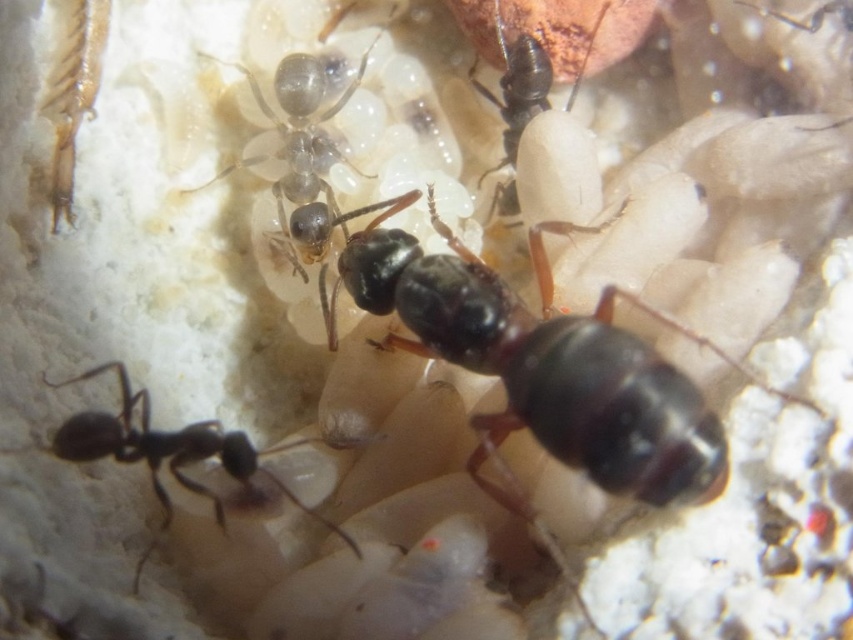
Question: Can you confirm if shiny black ant at center is thinner than black glossy ant at lower left?

Choices:
 (A) yes
 (B) no

Answer: (B)

Question: Which of the following is the closest to the observer?

Choices:
 (A) (743, 1)
 (B) (294, 124)
 (C) (125, 452)
 (D) (579, 416)

Answer: (D)

Question: Observing the image, what is the correct spatial positioning of translucent gelatinous ant at center in reference to shiny black ant at upper center?

Choices:
 (A) right
 (B) left

Answer: (B)

Question: Among these objects, which one is nearest to the camera?

Choices:
 (A) black glossy ant at lower left
 (B) shiny black ant at center

Answer: (B)

Question: Where is shiny black ant at center located in relation to black glossy ant at lower left in the image?

Choices:
 (A) below
 (B) above

Answer: (B)

Question: Which object is the closest to the black glossy ant at upper center?

Choices:
 (A) shiny black ant at upper center
 (B) shiny black ant at center
 (C) black glossy ant at lower left
 (D) translucent gelatinous ant at center

Answer: (D)